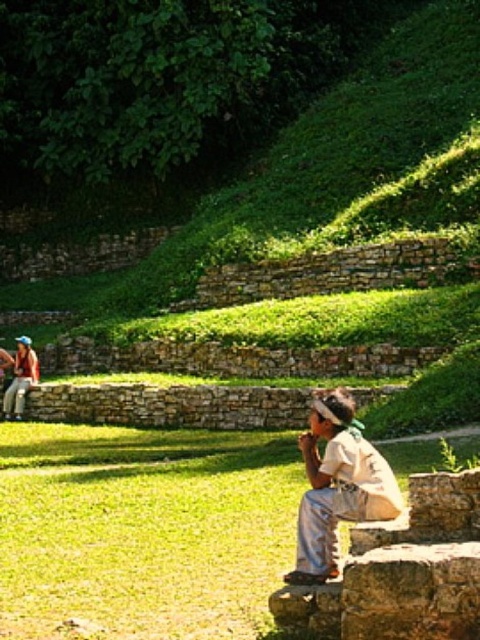
Which of these two, green grass at lower left or matte blue shirt at left, stands shorter?

Standing shorter between the two is green grass at lower left.

Locate an element on the screen. The height and width of the screenshot is (640, 480). green grass at lower left is located at coordinates (144, 531).

Is green grass at lower left thinner than khaki cotton shirt at center?

No.

Measure the distance between green grass at lower left and camera.

The distance of green grass at lower left from camera is 25.03 meters.

Between point (195, 618) and point (326, 548), which one is positioned in front?

Point (195, 618)

This screenshot has height=640, width=480. I want to click on green grass at lower left, so click(144, 531).

Does khaki cotton shirt at center appear on the left side of matte blue shirt at left?

Incorrect, khaki cotton shirt at center is not on the left side of matte blue shirt at left.

Which is behind, point (311, 436) or point (24, 378)?

Point (24, 378)

Where is `khaki cotton shirt at center`? The height and width of the screenshot is (640, 480). khaki cotton shirt at center is located at coordinates (337, 484).